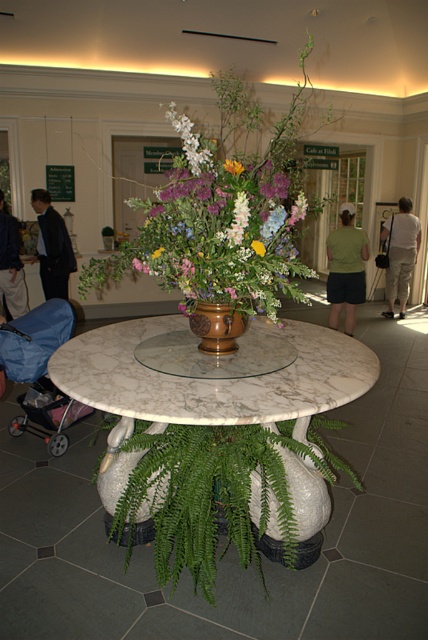
Question: Which object is positioned closest to the dark blue suit at left?

Choices:
 (A) white matte flowers at center
 (B) light beige pants at center
 (C) dark blue suit at center

Answer: (C)

Question: Which point is closer to the camera?

Choices:
 (A) marble table at center
 (B) light beige pants at center

Answer: (A)

Question: Estimate the real-world distances between objects in this image. Which object is closer to the dark blue suit at center?

Choices:
 (A) purple matte flower at center
 (B) pastel floral bouquet at center
 (C) brown glossy vase at center

Answer: (B)

Question: Does green fabric dress at center appear on the left side of dark blue suit at center?

Choices:
 (A) no
 (B) yes

Answer: (A)

Question: In this image, where is matte brown vase at center located relative to light beige pants at center?

Choices:
 (A) above
 (B) below

Answer: (B)

Question: Is matte brown vase at center behind purple matte flower at center?

Choices:
 (A) no
 (B) yes

Answer: (A)